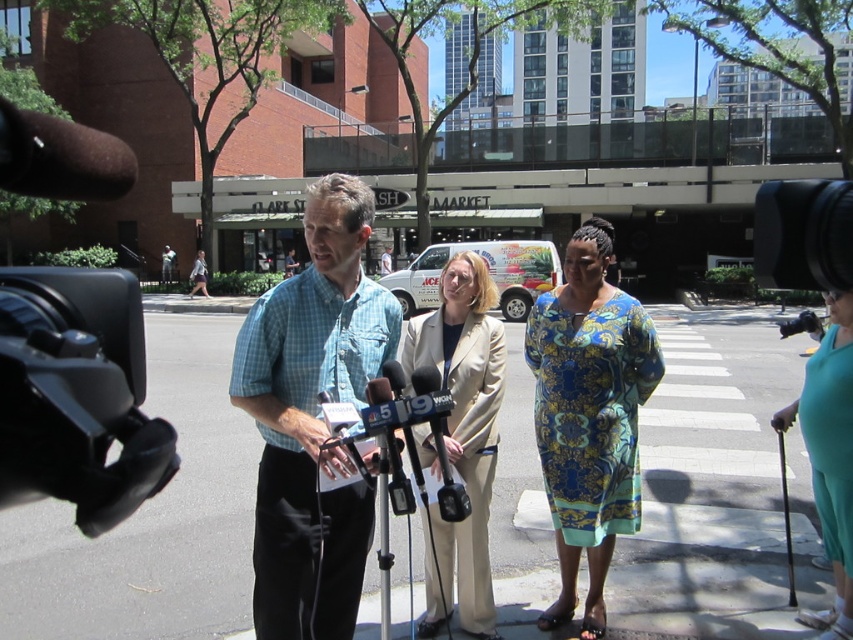
Does beige fabric suit at center appear under teal fabric dress at lower right?

Indeed, beige fabric suit at center is positioned under teal fabric dress at lower right.

Does beige fabric suit at center have a lesser height compared to teal fabric dress at lower right?

In fact, beige fabric suit at center may be taller than teal fabric dress at lower right.

Where is `beige fabric suit at center`? beige fabric suit at center is located at coordinates (462, 436).

Where is `beige fabric suit at center`? beige fabric suit at center is located at coordinates click(462, 436).

Who is positioned more to the right, blue floral dress at center or teal fabric dress at lower right?

teal fabric dress at lower right is more to the right.

Is blue floral dress at center below teal fabric dress at lower right?

Indeed, blue floral dress at center is positioned under teal fabric dress at lower right.

Between point (548, 451) and point (810, 416), which one is positioned in front?

Positioned in front is point (810, 416).

In order to click on blue floral dress at center in this screenshot , I will do `click(589, 416)`.

Is black matte video camera at left to the left of beige fabric suit at center from the viewer's perspective?

Yes, black matte video camera at left is to the left of beige fabric suit at center.

Is black matte video camera at left positioned in front of beige fabric suit at center?

Yes, black matte video camera at left is in front of beige fabric suit at center.

Is point (115, 278) closer to viewer compared to point (450, 440)?

Yes, point (115, 278) is closer to viewer.

At what (x,y) coordinates should I click in order to perform the action: click on black matte video camera at left. Please return your answer as a coordinate pair (x, y). The image size is (853, 640). Looking at the image, I should click on (77, 394).